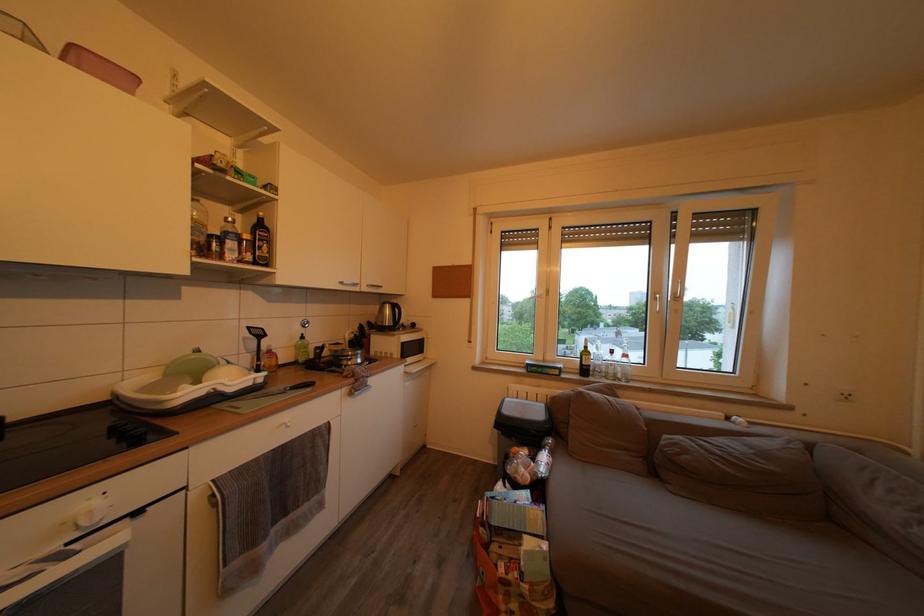
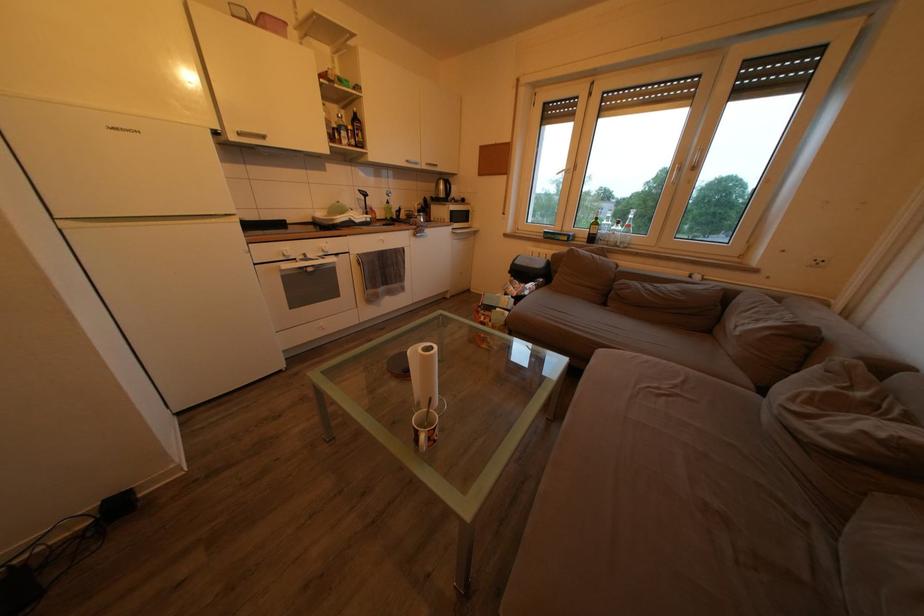
Which direction would the cameraman need to move to produce the second image?

The cameraman walked toward right, backward.